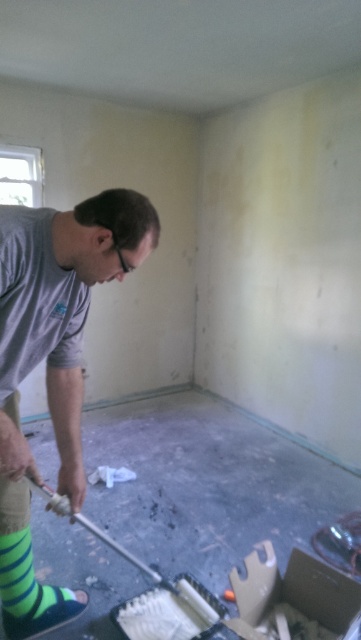
Can you confirm if gray cotton shirt at center is wider than green striped sock at lower left?

Indeed, gray cotton shirt at center has a greater width compared to green striped sock at lower left.

Find the location of a particular element. This screenshot has width=361, height=640. gray cotton shirt at center is located at coordinates (53, 365).

Between point (85, 275) and point (45, 600), which one is positioned in front?

Point (85, 275)

The height and width of the screenshot is (640, 361). I want to click on gray cotton shirt at center, so click(x=53, y=365).